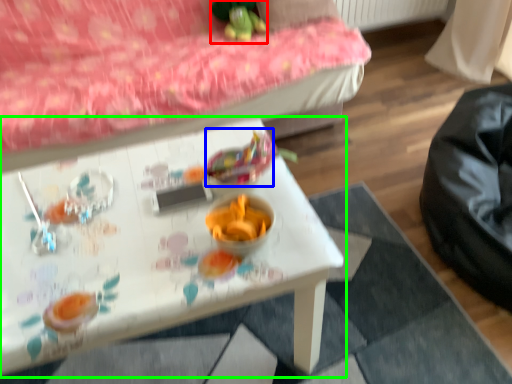
Question: Which is nearer to the toy (highlighted by a red box)? food (highlighted by a blue box) or table (highlighted by a green box).

Choices:
 (A) food
 (B) table

Answer: (A)